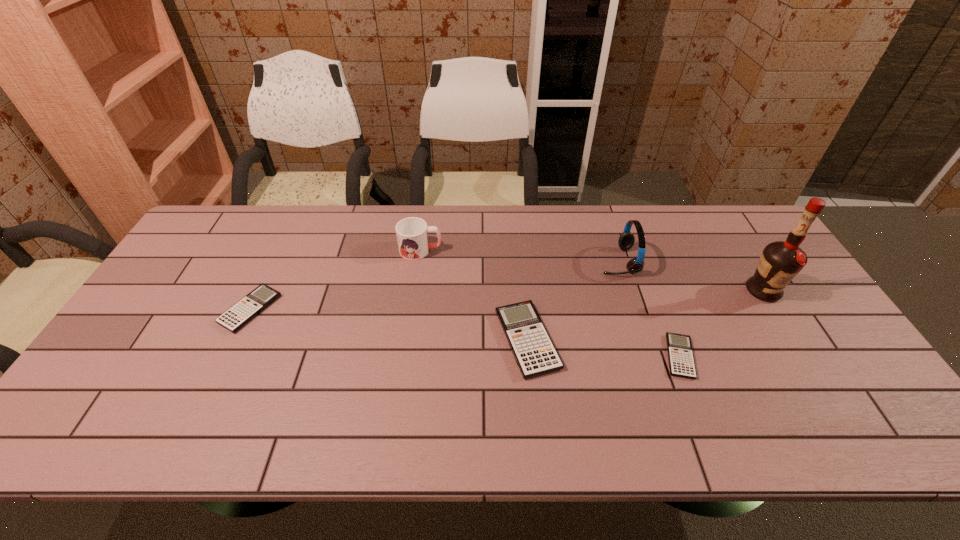
Locate an element on the screen. headset located at the far edge is located at coordinates (626, 240).

What are the coordinates of `object at the right edge` in the screenshot? It's located at (780, 261).

In the image, there is a desktop. Where is `vacant region at the far edge`? vacant region at the far edge is located at coordinates (326, 215).

Identify the location of free space at the near edge of the desktop. (299, 382).

Find the location of a particular element. This screenshot has width=960, height=540. vacant region at the left edge of the desktop is located at coordinates (183, 262).

In the image, there is a desktop. Identify the location of vacant area at the right edge. This screenshot has height=540, width=960. (756, 251).

Where is `free point between the mug and the tallest object`? The image size is (960, 540). free point between the mug and the tallest object is located at coordinates (591, 271).

Locate an element on the screen. The height and width of the screenshot is (540, 960). vacant space that is in between the fifth tallest object and the headset is located at coordinates (434, 285).

Where is `vacant region between the mug and the shortest object`? Image resolution: width=960 pixels, height=540 pixels. vacant region between the mug and the shortest object is located at coordinates (550, 303).

Where is `vacant point located between the tallest object and the shortest object`? The width and height of the screenshot is (960, 540). vacant point located between the tallest object and the shortest object is located at coordinates (721, 323).